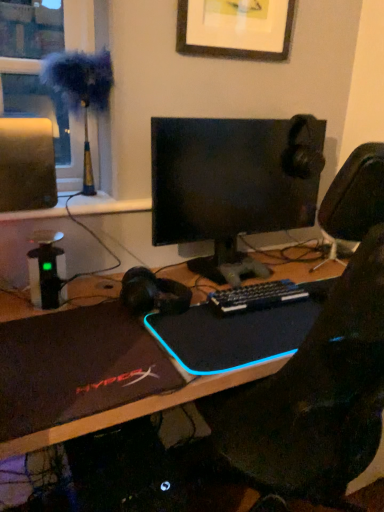
The image size is (384, 512). I want to click on vacant space underneath matte black laptop at lower left, which appears as the first laptop when viewed from the left (from a real-world perspective), so click(71, 353).